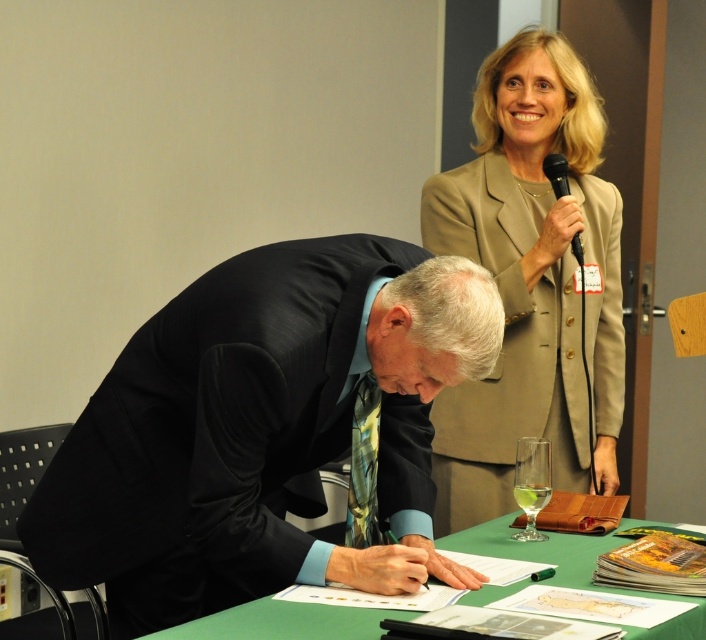
You are a photographer setting up for an event. You have a camera and need to position it so that both the black silk suit at center and the clear glass wine glass at lower center are in frame. Which object should you focus on first if you want to ensure both are visible without adjusting the camera angle?

The black silk suit at center is wider than the clear glass wine glass at lower center, so focusing on the black silk suit at center first will help ensure both objects are in frame without needing to adjust the camera angle.